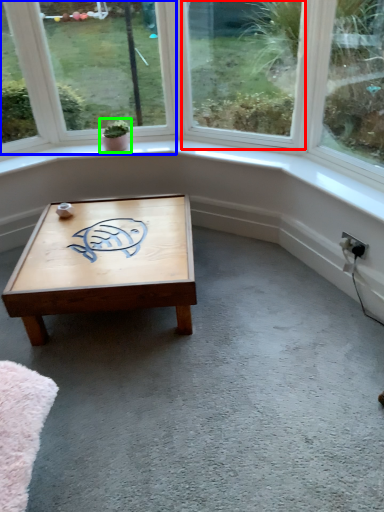
Question: Which object is positioned closest to window (highlighted by a red box)? Select from window (highlighted by a blue box) and houseplant (highlighted by a green box).

Choices:
 (A) window
 (B) houseplant

Answer: (A)